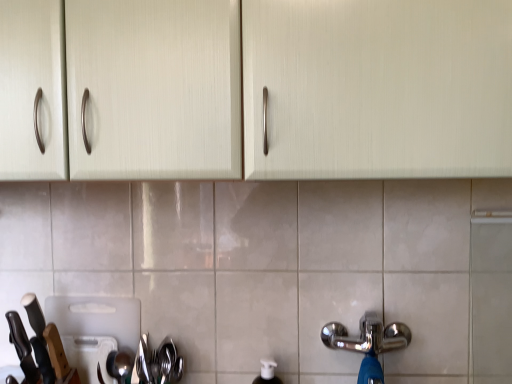
Question: From a real-world perspective, does satin silver spoon at lower left, positioned as the first appliance in front-to-back order, sit lower than matte cream cabinet at upper center?

Choices:
 (A) yes
 (B) no

Answer: (A)

Question: Is satin silver spoon at lower left, positioned as the first appliance in front-to-back order, positioned beyond the bounds of matte cream cabinet at upper center?

Choices:
 (A) yes
 (B) no

Answer: (A)

Question: Is there a large distance between satin silver spoon at lower left, positioned as the first appliance in front-to-back order, and matte cream cabinet at upper center?

Choices:
 (A) no
 (B) yes

Answer: (A)

Question: Can you confirm if satin silver spoon at lower left, positioned as the second appliance in back-to-front order, is wider than matte cream cabinet at upper center?

Choices:
 (A) no
 (B) yes

Answer: (A)

Question: Does satin silver spoon at lower left, positioned as the first appliance in front-to-back order, have a lesser height compared to matte cream cabinet at upper center?

Choices:
 (A) no
 (B) yes

Answer: (B)

Question: Is black matte knife at left, positioned as the 2th knife in left-to-right order, in front of or behind shiny metallic spoon at lower left in the image?

Choices:
 (A) behind
 (B) front

Answer: (B)

Question: Would you say black matte knife at left, positioned as the 2th knife in left-to-right order, is to the left or to the right of shiny metallic spoon at lower left in the picture?

Choices:
 (A) left
 (B) right

Answer: (A)

Question: Considering the positions of point (41, 336) and point (159, 367), is point (41, 336) closer or farther from the camera than point (159, 367)?

Choices:
 (A) closer
 (B) farther

Answer: (A)

Question: Do you think black matte knife at left, the 1th knife from the right, is within shiny metallic spoon at lower left, or outside of it?

Choices:
 (A) inside
 (B) outside

Answer: (B)

Question: In terms of size, does shiny metallic spoon at lower left appear bigger or smaller than white plastic cutting board at lower left, the second appliance when ordered from front to back?

Choices:
 (A) small
 (B) big

Answer: (A)

Question: Is point (126, 367) closer or farther from the camera than point (96, 306)?

Choices:
 (A) farther
 (B) closer

Answer: (B)

Question: Is shiny metallic spoon at lower left to the left or to the right of white plastic cutting board at lower left, the second appliance when ordered from front to back, in the image?

Choices:
 (A) right
 (B) left

Answer: (A)

Question: From a real-world perspective, is shiny metallic spoon at lower left physically located above or below white plastic cutting board at lower left, the second appliance when ordered from front to back?

Choices:
 (A) below
 (B) above

Answer: (B)

Question: From the image's perspective, is chrome metallic tap at lower right located above or below white plastic cutting board at lower left, acting as the first appliance starting from the back?

Choices:
 (A) above
 (B) below

Answer: (A)

Question: Is chrome metallic tap at lower right wider or thinner than white plastic cutting board at lower left, acting as the first appliance starting from the back?

Choices:
 (A) thin
 (B) wide

Answer: (B)